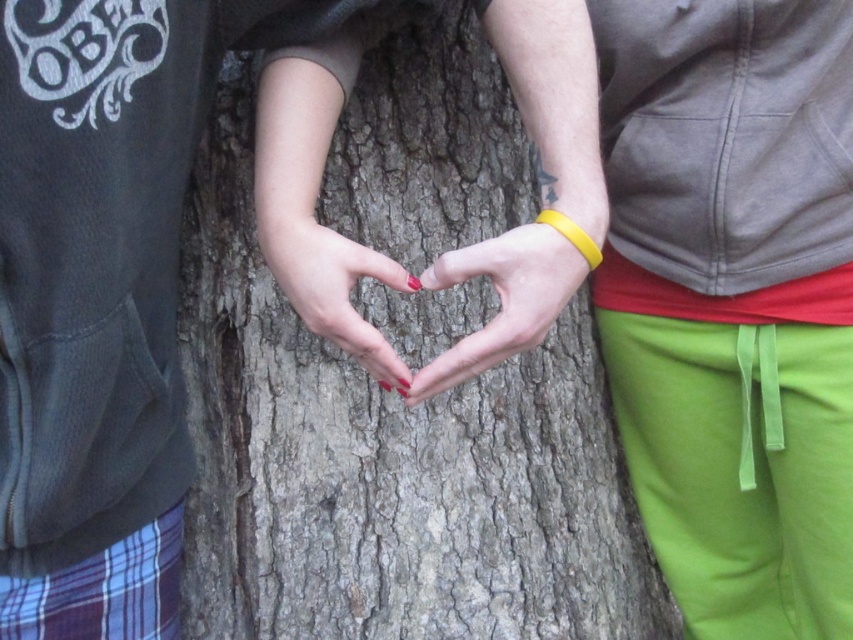
Looking at this image, you are standing in front of the scene described. You want to place a small sticker exactly at the point marked as point (521, 321). If your hand is currently at your side, which direction should you move it to reach that point?

Since the point (521, 321) is 33.32 inches away from the viewer, you need to extend your arm forward to reach it.

You are a photographer who wants to capture the heart shape formed by the two people. Based on the scene, which object is closer to the camera between the smooth skin heart at center and the nail polish at center?

The smooth skin heart at center is below the nail polish at center, so the nail polish at center is closer to the camera.

You are a photographer trying to capture the heart shape formed by the two people. To ensure the tree trunk is in the background, where should you position your camera relative to the smooth bark tree trunk at center?

The smooth bark tree trunk at center is located at point (387, 464), so position the camera so that the trunk is behind the subjects to keep it as the background.